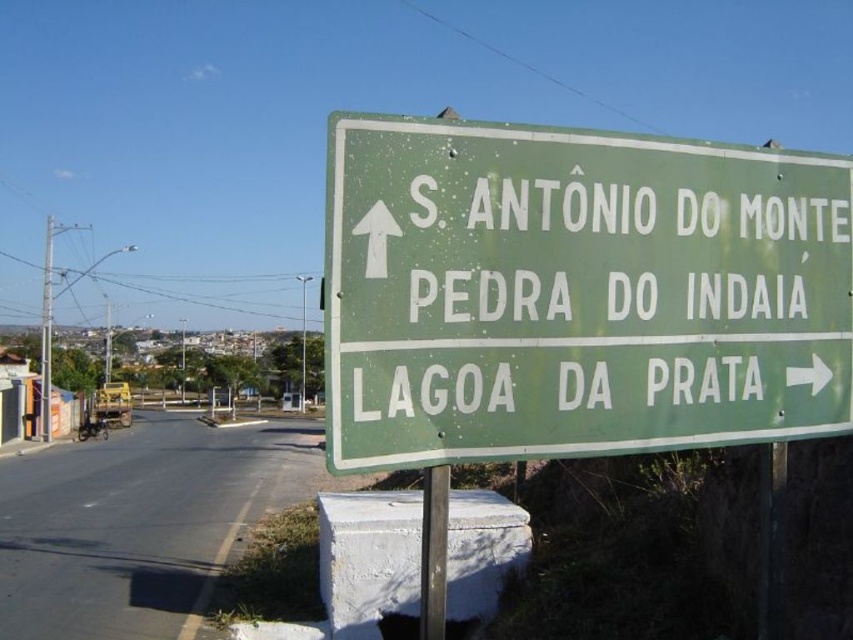
You are driving and see the green matte sign at upper right. According to its position, which direction should you turn to follow the route towards LAGOA DA PRATA?

The green matte sign at upper right indicates that to follow the route towards LAGOA DA PRATA, you should turn right, as the sign shows the direction with a rightward arrow.

You are driving and need to attach a 36 inch long safety chain between the green matte sign at upper right and the metallic pole at center. Can the chain reach without being stretched?

The distance between the green matte sign at upper right and the metallic pole at center is 38.12 inches. Since the safety chain is 36 inches long, it is shorter than the required distance. The chain cannot reach without being stretched.